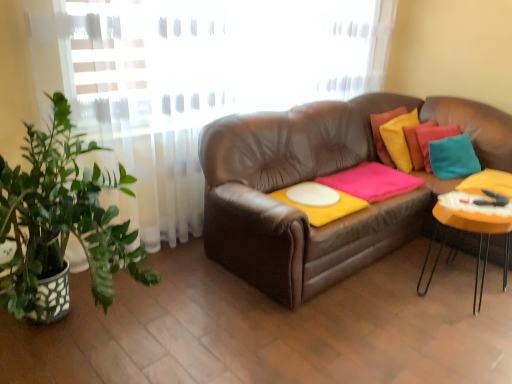
Question: Is the depth of pink matte blanket at center greater than that of white matte round table at center?

Choices:
 (A) no
 (B) yes

Answer: (B)

Question: Does pink matte blanket at center have a larger size compared to white matte round table at center?

Choices:
 (A) no
 (B) yes

Answer: (B)

Question: From a real-world perspective, does pink matte blanket at center stand above white matte round table at center?

Choices:
 (A) no
 (B) yes

Answer: (B)

Question: Can white matte round table at center be found inside pink matte blanket at center?

Choices:
 (A) no
 (B) yes

Answer: (A)

Question: Can you confirm if pink matte blanket at center is positioned to the left of white matte round table at center?

Choices:
 (A) yes
 (B) no

Answer: (B)

Question: From a real-world perspective, is pink matte blanket at center positioned under white matte round table at center based on gravity?

Choices:
 (A) no
 (B) yes

Answer: (A)

Question: Is white matte round table at center completely or partially inside orange matte table at right?

Choices:
 (A) no
 (B) yes

Answer: (A)

Question: Considering the relative sizes of orange matte table at right and white matte round table at center in the image provided, is orange matte table at right bigger than white matte round table at center?

Choices:
 (A) no
 (B) yes

Answer: (B)

Question: Can you confirm if orange matte table at right is smaller than white matte round table at center?

Choices:
 (A) no
 (B) yes

Answer: (A)

Question: From the image's perspective, does orange matte table at right appear higher than white matte round table at center?

Choices:
 (A) no
 (B) yes

Answer: (A)

Question: Does orange matte table at right appear on the right side of white matte round table at center?

Choices:
 (A) no
 (B) yes

Answer: (B)

Question: Is the surface of orange matte table at right in direct contact with white matte round table at center?

Choices:
 (A) yes
 (B) no

Answer: (B)

Question: Could you tell me if orange matte table at right is turned towards pink matte blanket at center?

Choices:
 (A) no
 (B) yes

Answer: (A)